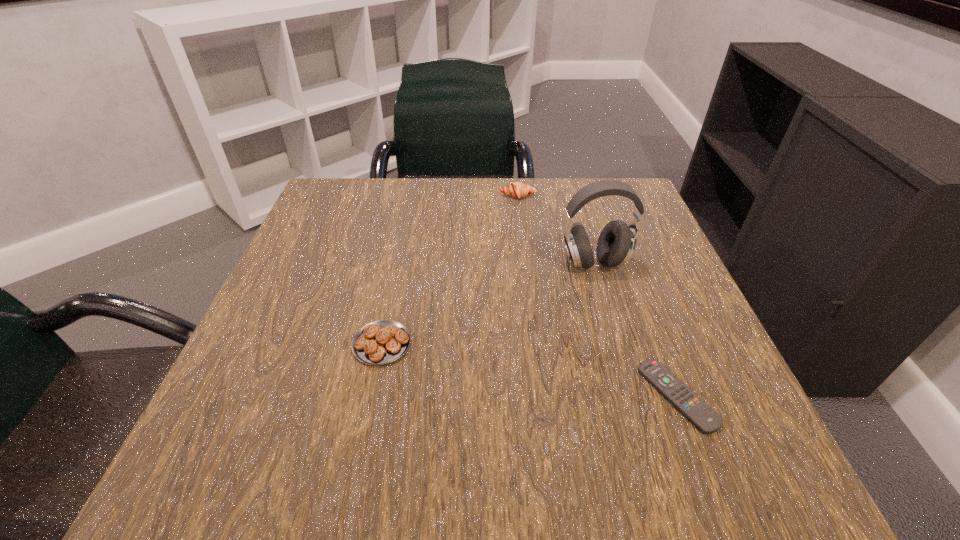
At what (x,y) coordinates should I click in order to perform the action: click on vacant space in between the third nearest object and the shortest object. Please return your answer as a coordinate pair (x, y). The height and width of the screenshot is (540, 960). Looking at the image, I should click on (636, 329).

The image size is (960, 540). Identify the location of free space between the headset and the third tallest object. (488, 303).

Where is `free space between the farthest object and the second farthest object`? free space between the farthest object and the second farthest object is located at coordinates (556, 230).

Identify which object is the second closest to the second farthest object. Please provide its 2D coordinates. Your answer should be formatted as a tuple, i.e. [(x, y)], where the tuple contains the x and y coordinates of a point satisfying the conditions above.

[(701, 415)]

Identify the location of object that is the third closest to the second shortest object. This screenshot has height=540, width=960. (518, 190).

The width and height of the screenshot is (960, 540). I want to click on vacant area that satisfies the following two spatial constraints: 1. on the front-facing side of the remote control; 2. on the right side of the second tallest object, so click(542, 396).

I want to click on vacant area in the image that satisfies the following two spatial constraints: 1. on the ear cups of the headset; 2. on the right side of the shortest object, so click(633, 396).

At what (x,y) coordinates should I click in order to perform the action: click on blank area in the image that satisfies the following two spatial constraints: 1. on the ear cups of the remote control; 2. on the right side of the headset. Please return your answer as a coordinate pair (x, y). Looking at the image, I should click on (633, 396).

Locate an element on the screen. vacant position in the image that satisfies the following two spatial constraints: 1. on the ear cups of the remote control; 2. on the left side of the tallest object is located at coordinates (633, 396).